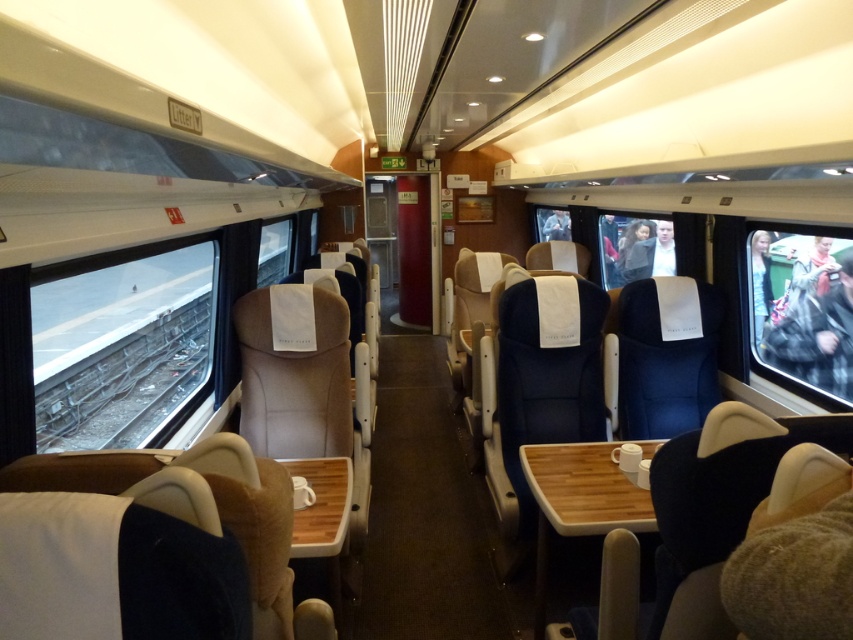
Question: Which object is closer to the camera taking this photo?

Choices:
 (A) clear glass window at center
 (B) transparent plastic window at right

Answer: (B)

Question: Does dark gray metal train track at left have a larger size compared to clear glass window at center?

Choices:
 (A) yes
 (B) no

Answer: (B)

Question: Which point appears farthest from the camera in this image?

Choices:
 (A) (666, 266)
 (B) (752, 260)
 (C) (672, 253)
 (D) (142, 413)

Answer: (A)

Question: Among these points, which one is farthest from the camera?

Choices:
 (A) (612, 269)
 (B) (766, 296)
 (C) (134, 340)
 (D) (647, 237)

Answer: (A)

Question: Can you confirm if transparent plastic window at right is thinner than clear glass window at center?

Choices:
 (A) no
 (B) yes

Answer: (B)

Question: Observing the image, what is the correct spatial positioning of dark gray metal train track at left in reference to clear glass window at center?

Choices:
 (A) above
 (B) below

Answer: (B)